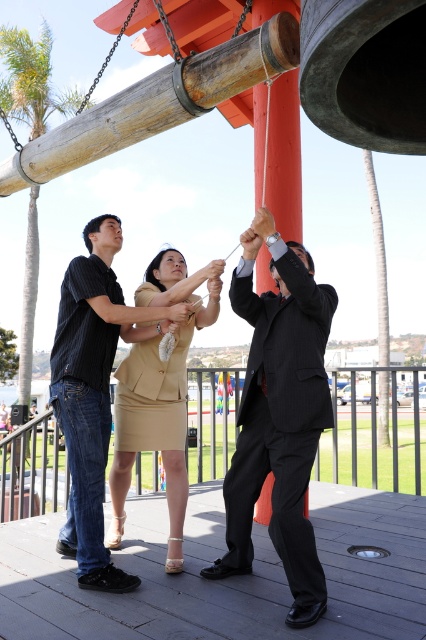
Does point (310, 605) come closer to viewer compared to point (78, 515)?

Yes.

The width and height of the screenshot is (426, 640). What do you see at coordinates (279, 413) in the screenshot? I see `dark gray pinstripe suit at center` at bounding box center [279, 413].

You are a GUI agent. You are given a task and a screenshot of the screen. Output one action in this format:
    pyautogui.click(x=<x>, y=<y>)
    Task: Click on the dark gray pinstripe suit at center
    The image size is (426, 640).
    Given the screenshot: What is the action you would take?
    pyautogui.click(x=279, y=413)

This screenshot has width=426, height=640. Find the location of `dark gray pinstripe suit at center`. dark gray pinstripe suit at center is located at coordinates (279, 413).

Who is positioned more to the right, beige fabric dress at center or dark gray pinstripe suit at center?

Positioned to the right is dark gray pinstripe suit at center.

Does point (256, 250) come closer to viewer compared to point (291, 522)?

No, it is not.

This screenshot has height=640, width=426. What do you see at coordinates (279, 413) in the screenshot?
I see `beige fabric dress at center` at bounding box center [279, 413].

Identify the location of beige fabric dress at center. (279, 413).

In the scene shown: Measure the distance between beige fabric dress at center and camera.

beige fabric dress at center and camera are 9.85 feet apart.

Does beige fabric dress at center lie behind beige fabric skirt at center?

No, beige fabric dress at center is in front of beige fabric skirt at center.

The image size is (426, 640). Describe the element at coordinates (279, 413) in the screenshot. I see `beige fabric dress at center` at that location.

Where is `beige fabric dress at center`? beige fabric dress at center is located at coordinates (279, 413).